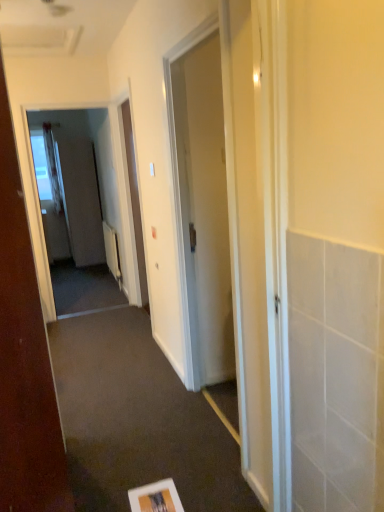
Question: Is white sheer curtain at left oriented towards matte white screen door at left, the 1th screen door in the left-to-right sequence?

Choices:
 (A) yes
 (B) no

Answer: (B)

Question: Can you confirm if white sheer curtain at left is smaller than matte white screen door at left, the second screen door viewed from the front?

Choices:
 (A) no
 (B) yes

Answer: (B)

Question: Does white sheer curtain at left lie behind matte white screen door at left, the 1th screen door in the left-to-right sequence?

Choices:
 (A) yes
 (B) no

Answer: (A)

Question: Is white sheer curtain at left in contact with matte white screen door at left, which is the 2th screen door in right-to-left order?

Choices:
 (A) yes
 (B) no

Answer: (B)

Question: Is white sheer curtain at left not within matte white screen door at left, the second screen door viewed from the front?

Choices:
 (A) yes
 (B) no

Answer: (A)

Question: Is point (49, 176) closer or farther from the camera than point (178, 72)?

Choices:
 (A) closer
 (B) farther

Answer: (B)

Question: Relative to white glossy door at center, which appears as the first door when viewed from the back, is white sheer curtain at left in front or behind?

Choices:
 (A) front
 (B) behind

Answer: (B)

Question: Choose the correct answer: Is white sheer curtain at left inside white glossy door at center, arranged as the 2th door when viewed from the front, or outside it?

Choices:
 (A) outside
 (B) inside

Answer: (A)

Question: Is white sheer curtain at left to the left or to the right of white glossy door at center, arranged as the 2th door when viewed from the front, in the image?

Choices:
 (A) left
 (B) right

Answer: (A)

Question: Is white glossy door at center, the second door viewed from the left, inside or outside of transparent glass screen door at left, which is the first screen door from right to left?

Choices:
 (A) outside
 (B) inside

Answer: (A)

Question: In terms of height, does white glossy door at center, which appears as the first door when viewed from the back, look taller or shorter compared to transparent glass screen door at left, marked as the second screen door in a back-to-front arrangement?

Choices:
 (A) tall
 (B) short

Answer: (B)

Question: Does point pyautogui.click(x=206, y=288) appear closer or farther from the camera than point pyautogui.click(x=64, y=196)?

Choices:
 (A) farther
 (B) closer

Answer: (B)

Question: From the image's perspective, is white glossy door at center, the second door viewed from the left, located above or below transparent glass screen door at left, marked as the second screen door in a back-to-front arrangement?

Choices:
 (A) below
 (B) above

Answer: (A)

Question: Is matte white screen door at left, which is the 2th screen door in right-to-left order, wider or thinner than white sheer curtain at left?

Choices:
 (A) wide
 (B) thin

Answer: (A)

Question: Looking at the image, does matte white screen door at left, the second screen door viewed from the front, seem bigger or smaller compared to white sheer curtain at left?

Choices:
 (A) big
 (B) small

Answer: (A)